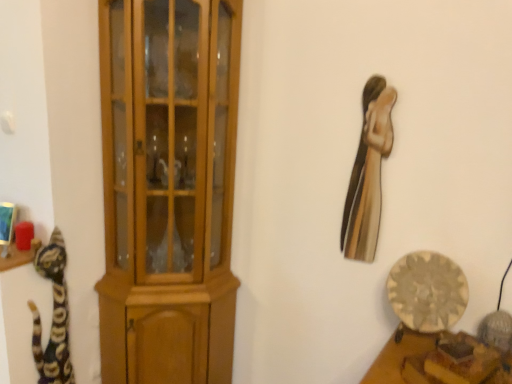
Question: From a real-world perspective, is multicolored fur cat at left above or below light brown wood cupboard at left?

Choices:
 (A) above
 (B) below

Answer: (B)

Question: In terms of size, does multicolored fur cat at left appear bigger or smaller than light brown wood cupboard at left?

Choices:
 (A) big
 (B) small

Answer: (B)

Question: Considering the real-world distances, which object is closest to the light brown wood cupboard at left?

Choices:
 (A) metallic gold statue at upper right
 (B) wooden plate at lower right
 (C) multicolored fur cat at left

Answer: (C)

Question: Based on their relative distances, which object is farther from the metallic gold statue at upper right?

Choices:
 (A) wooden plate at lower right
 (B) multicolored fur cat at left
 (C) light brown wood cupboard at left

Answer: (B)